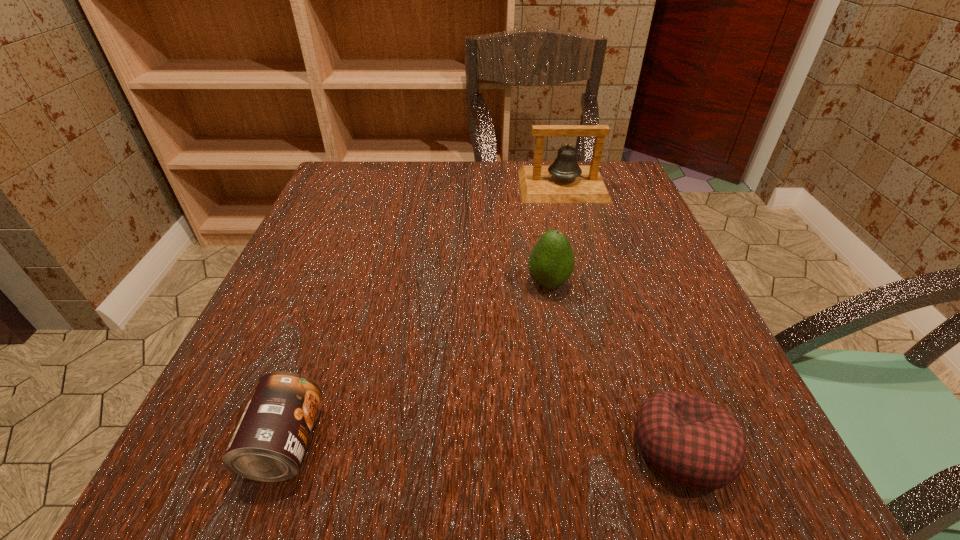
Image resolution: width=960 pixels, height=540 pixels. In order to click on the farthest object in this screenshot , I will do click(x=564, y=181).

Locate an element on the screen. Image resolution: width=960 pixels, height=540 pixels. the tallest object is located at coordinates (564, 181).

Identify the location of the second tallest object. The image size is (960, 540). (551, 262).

Where is `avocado`? avocado is located at coordinates (551, 262).

The width and height of the screenshot is (960, 540). I want to click on the leftmost object, so click(x=268, y=445).

The width and height of the screenshot is (960, 540). I want to click on beanbag, so click(693, 442).

Where is `vacant area located 0.250m on the front of the tallest object`? This screenshot has width=960, height=540. vacant area located 0.250m on the front of the tallest object is located at coordinates (588, 274).

Locate an element on the screen. The image size is (960, 540). vacant space situated 0.320m on the front of the second farthest object is located at coordinates 583,482.

Where is `free space located on the front label of the can`? The width and height of the screenshot is (960, 540). free space located on the front label of the can is located at coordinates 372,443.

You are a GUI agent. You are given a task and a screenshot of the screen. Output one action in this format:
    pyautogui.click(x=<x>, y=<y>)
    Task: Click on the vacant region located on the left of the beanbag
    The width and height of the screenshot is (960, 540).
    Given the screenshot: What is the action you would take?
    pyautogui.click(x=515, y=448)